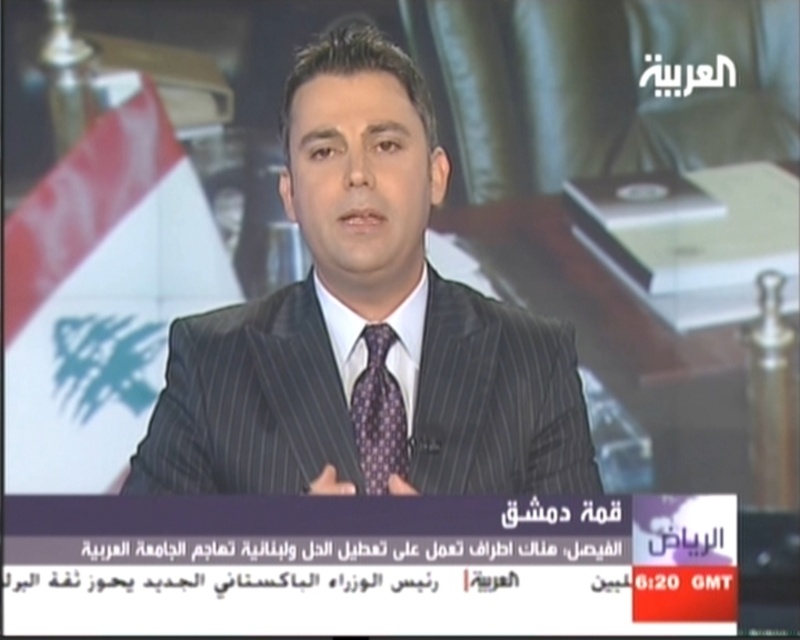
Is matte black suit at center behind purple printed tie at center?

No.

Is point (364, 129) farther from camera compared to point (378, 348)?

No, (364, 129) is in front of (378, 348).

This screenshot has width=800, height=640. What do you see at coordinates (364, 323) in the screenshot? I see `matte black suit at center` at bounding box center [364, 323].

Locate an element on the screen. The image size is (800, 640). matte black suit at center is located at coordinates (364, 323).